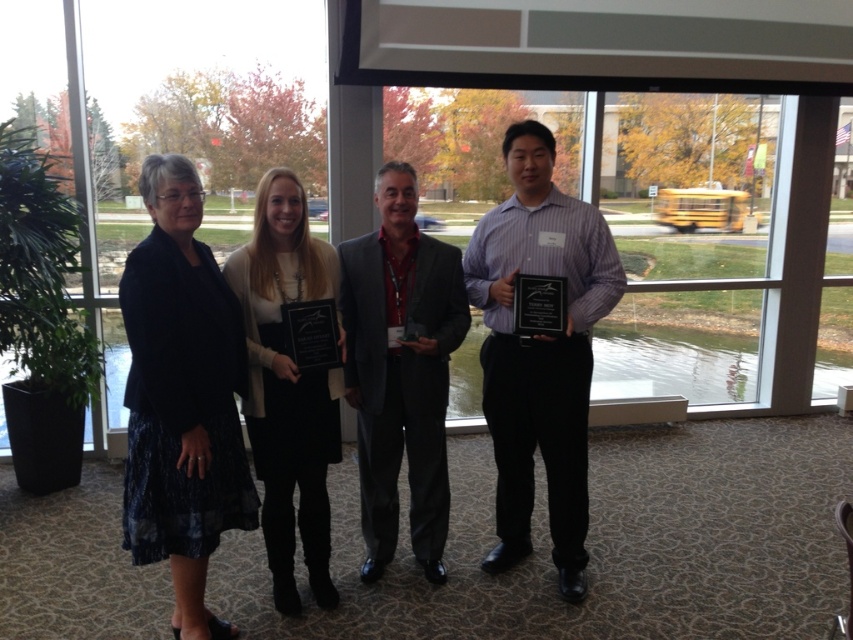
You are organizing a photo shoot and need to ensure that the dark gray suit at center and the black glossy plaque at right are both visible in the frame. Based on their sizes, which object should you prioritize keeping centered to avoid cropping?

The dark gray suit at center might be wider than black glossy plaque at right, so you should prioritize keeping the dark gray suit at center centered to avoid cropping.

You are a photographer at the event and need to ensure that the dark gray suit at center and the black glossy plaque at right are both visible in the photo. Considering their heights, which object should you focus on first to ensure proper framing?

The dark gray suit at center is taller than the black glossy plaque at right, so you should focus on the dark gray suit at center first to ensure proper framing.

You are organizing a photo shoot and need to ensure that the purple shirt at center and the dark gray suit at center are visible in the final image. Based on their sizes, which one might require more attention to ensure it doesn

The purple shirt at center is larger in size than the dark gray suit at center, so it might require more attention to ensure it is visible in the final image.